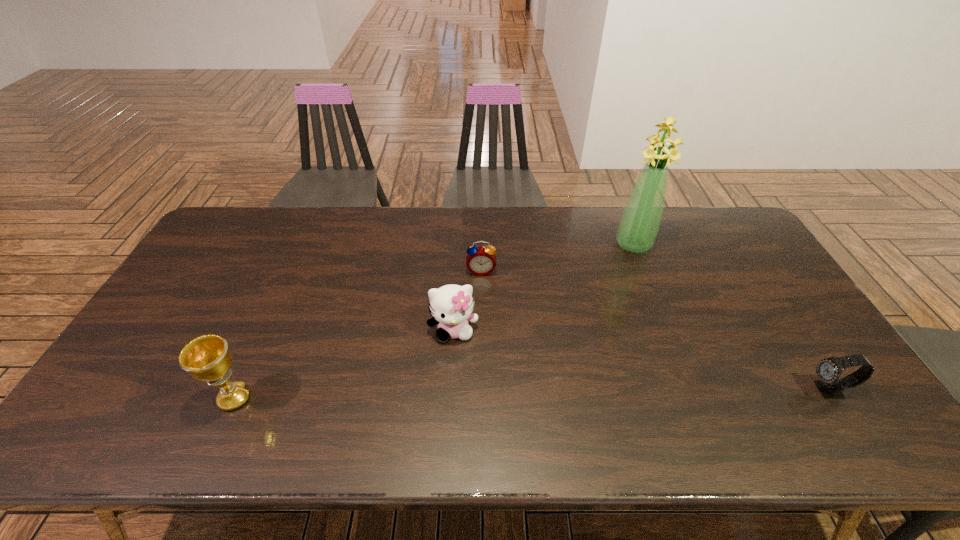
Where is `vacant area situated on the face of the watch`? vacant area situated on the face of the watch is located at coordinates (687, 390).

At what (x,y) coordinates should I click in order to perform the action: click on vacant space located 0.060m on the front-facing side of the third farthest object. Please return your answer as a coordinate pair (x, y). This screenshot has width=960, height=540. Looking at the image, I should click on tap(459, 364).

Where is `vacant space located 0.130m on the front-facing side of the third farthest object`? The height and width of the screenshot is (540, 960). vacant space located 0.130m on the front-facing side of the third farthest object is located at coordinates (463, 387).

Where is `vacant space situated on the front-facing side of the third farthest object`? The image size is (960, 540). vacant space situated on the front-facing side of the third farthest object is located at coordinates (461, 377).

Find the location of `free space located on the front-facing side of the fourth nearest object`. free space located on the front-facing side of the fourth nearest object is located at coordinates (480, 337).

Locate an element on the screen. This screenshot has width=960, height=540. blank area located 0.400m on the front-facing side of the fourth nearest object is located at coordinates (479, 388).

Locate an element on the screen. The width and height of the screenshot is (960, 540). free space located on the front-facing side of the fourth nearest object is located at coordinates (480, 315).

Identify the location of vacant position located on the front-facing side of the farthest object. (609, 301).

Locate an element on the screen. Image resolution: width=960 pixels, height=540 pixels. vacant point located 0.060m on the front-facing side of the farthest object is located at coordinates (624, 267).

Image resolution: width=960 pixels, height=540 pixels. In order to click on free space located on the front-facing side of the farthest object in this screenshot , I will do `click(624, 267)`.